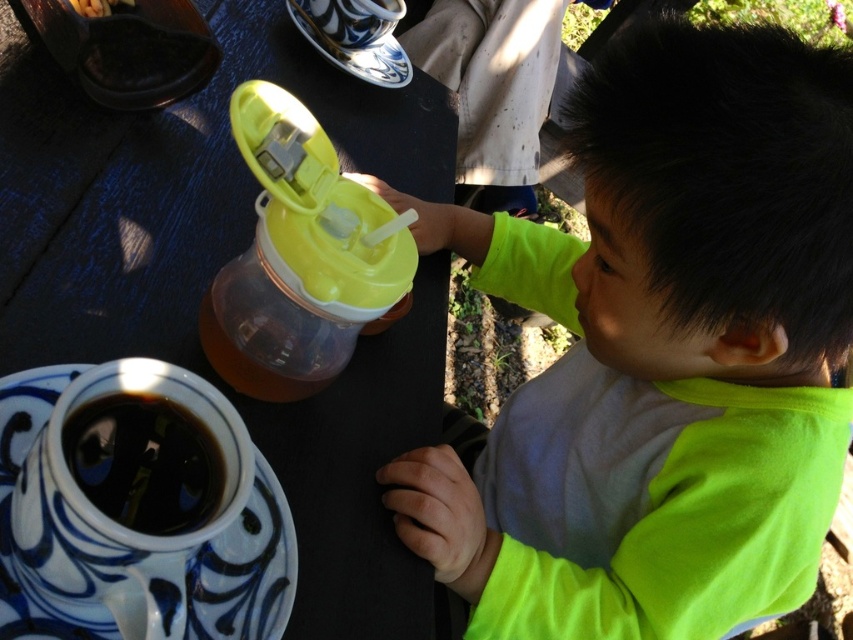
You are a parent at the table with your child. You have two cups available, the translucent plastic sippy cup at center and the yellow translucent cup at upper left. Which cup has a larger opening for drinking?

The translucent plastic sippy cup at center might be wider than yellow translucent cup at upper left, so it likely has a larger opening for drinking.

You are a parent at the outdoor table and want to place a small snack on the table. If you want to place the snack as close as possible to the translucent plastic sippy cup at center without touching it, where should you place it?

The snack should be placed as close as possible to the translucent plastic sippy cup at center but not touching it, ideally just next to its position at point (x=300, y=257).